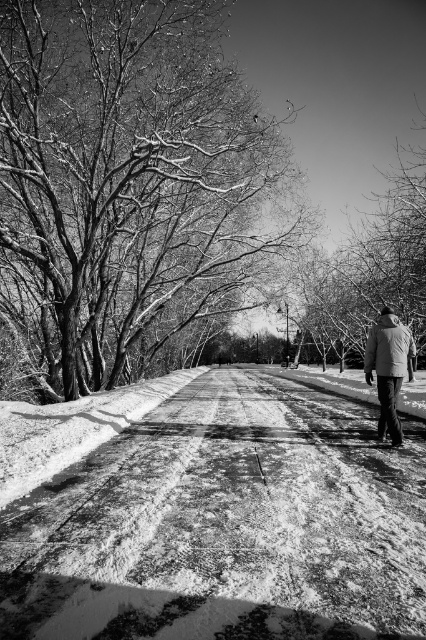
Is point (141, 148) farther from camera compared to point (423, 170)?

No, it is not.

Is the position of snow-covered branches at upper left more distant than that of bare branches at upper center?

That is False.

Between point (131, 291) and point (389, 296), which one is positioned in front?

Point (389, 296) is in front.

You are a GUI agent. You are given a task and a screenshot of the screen. Output one action in this format:
    pyautogui.click(x=<x>, y=<y>)
    Task: Click on the snow-covered branches at upper left
    This screenshot has width=426, height=640.
    Given the screenshot: What is the action you would take?
    pyautogui.click(x=129, y=173)

What do you see at coordinates (224, 525) in the screenshot? I see `snowy asphalt road at center` at bounding box center [224, 525].

Is snowy asphalt road at center further to the viewer compared to coated fabric jacket at lower right?

That is False.

Is point (117, 572) positioned after point (394, 353)?

No, (117, 572) is in front of (394, 353).

I want to click on snowy asphalt road at center, so click(x=224, y=525).

Between point (58, 520) and point (287, 177), which one is positioned in front?

Positioned in front is point (58, 520).

Which is below, snowy asphalt road at center or snow-covered branches at upper left?

snowy asphalt road at center

Is point (367, 417) farther from camera compared to point (95, 300)?

No.

Find the location of a particular element. The height and width of the screenshot is (640, 426). snowy asphalt road at center is located at coordinates (224, 525).